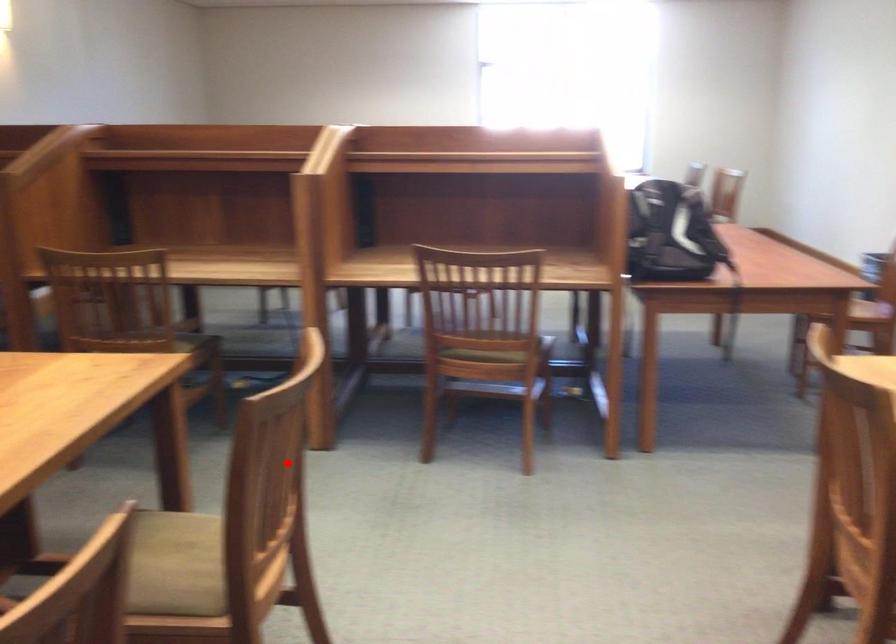
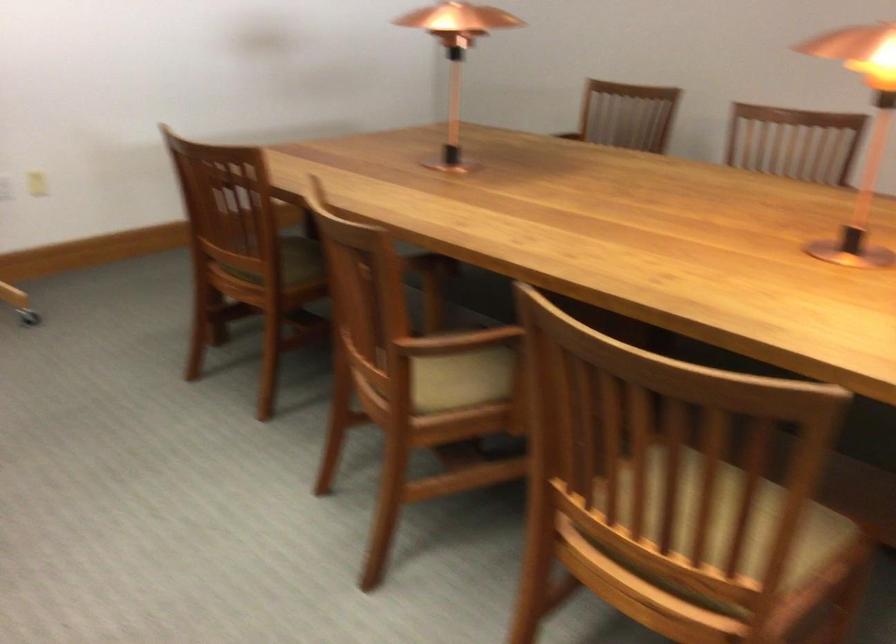
Question: I am providing you with two images of the same scene from different viewpoints. A red point is shown in image1. For the corresponding object point in image2, is it positioned nearer or farther from the camera?

Choices:
 (A) Nearer
 (B) Farther

Answer: (A)